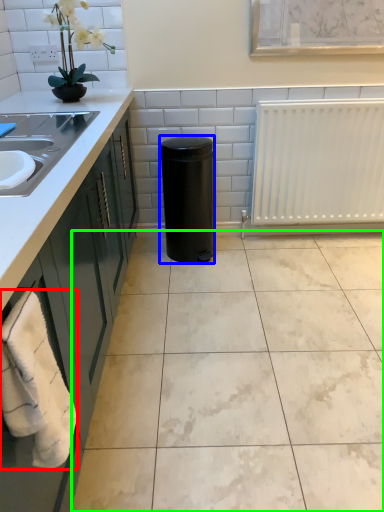
Question: Based on their relative distances, which object is nearer to bath towel (highlighted by a red box)? Choose from appliance (highlighted by a blue box) and ceramic tile (highlighted by a green box).

Choices:
 (A) appliance
 (B) ceramic tile

Answer: (B)